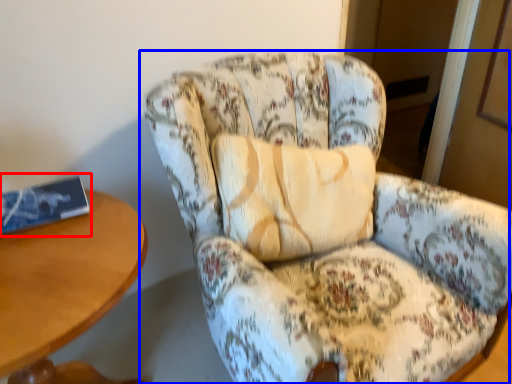
Question: Which object is further to the camera taking this photo, book (highlighted by a red box) or chair (highlighted by a blue box)?

Choices:
 (A) book
 (B) chair

Answer: (A)